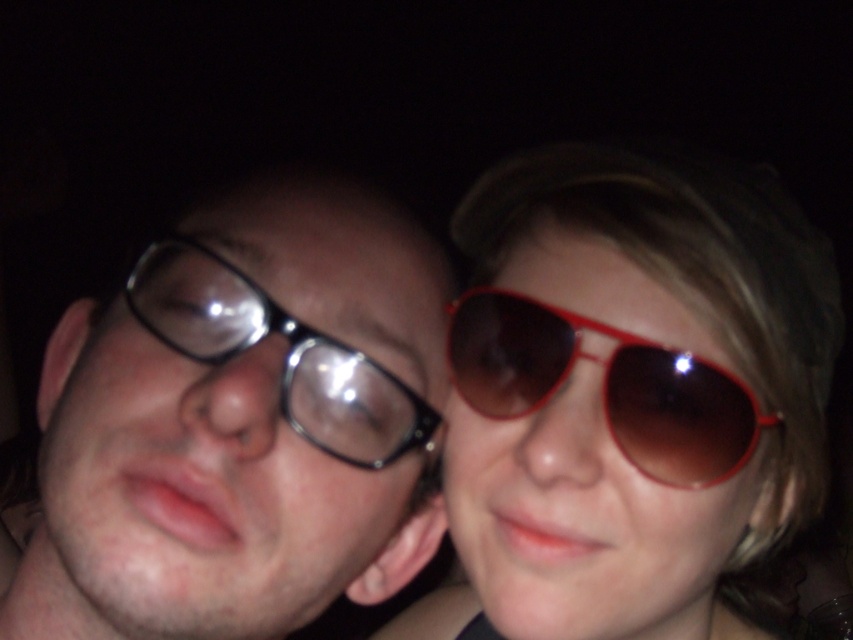
Question: Can you confirm if matte black glasses at left is bigger than black plastic glasses at left?

Choices:
 (A) yes
 (B) no

Answer: (A)

Question: Does matte black glasses at left appear under red shiny sunglasses at right?

Choices:
 (A) no
 (B) yes

Answer: (B)

Question: Is matte black glasses at left thinner than red shiny sunglasses at right?

Choices:
 (A) no
 (B) yes

Answer: (A)

Question: Which object is the farthest from the black plastic glasses at left?

Choices:
 (A) matte red sunglasses at upper right
 (B) red shiny sunglasses at right

Answer: (A)

Question: Which point is closer to the camera taking this photo?

Choices:
 (A) (270, 435)
 (B) (457, 371)
 (C) (247, 340)
 (D) (572, 256)

Answer: (A)

Question: Which point is closer to the camera?

Choices:
 (A) (698, 417)
 (B) (589, 225)

Answer: (A)